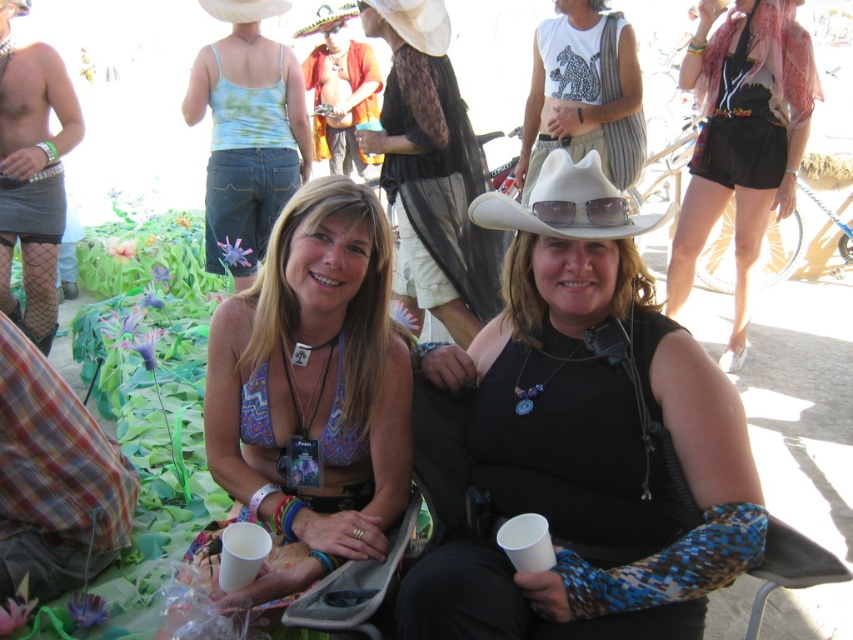
Question: Which of the following is the farthest from the observer?

Choices:
 (A) (277, 10)
 (B) (442, 4)

Answer: (A)

Question: Can you confirm if plaid fabric at lower left is positioned to the left of multicolored felt sombrero at upper center?

Choices:
 (A) no
 (B) yes

Answer: (A)

Question: Which point is farther to the camera?

Choices:
 (A) (581, 228)
 (B) (672, 316)
 (C) (641, 525)

Answer: (B)

Question: Which point is farther to the camera?

Choices:
 (A) (683, 532)
 (B) (302, 26)
 (C) (538, 214)
 (D) (453, 340)

Answer: (B)

Question: Can you confirm if matte black shirt at center is positioned to the right of tie-dye fabric tank top at upper left?

Choices:
 (A) no
 (B) yes

Answer: (B)

Question: From the image, what is the correct spatial relationship of white matte cowboy hat at center in relation to white matte cowboy hat at upper center?

Choices:
 (A) right
 (B) left

Answer: (A)